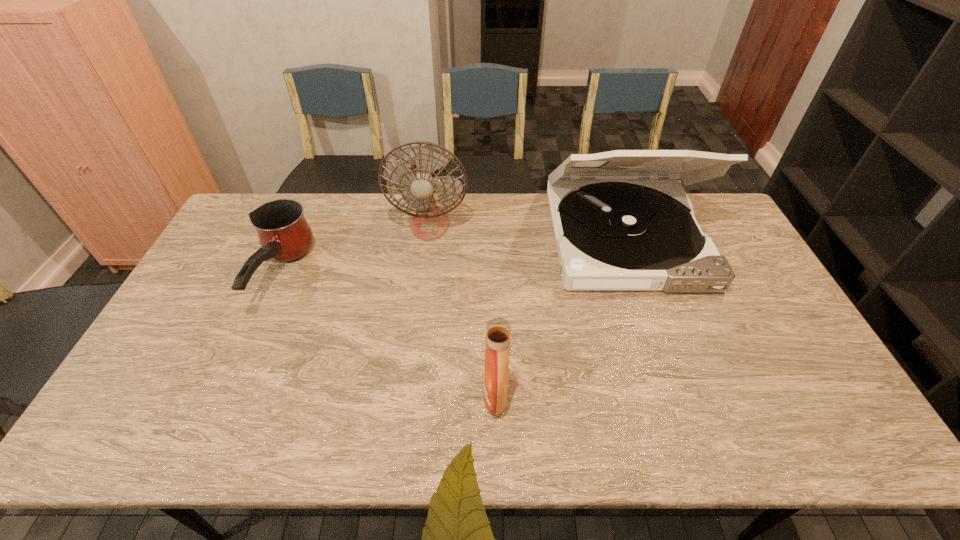
Identify the location of the rightmost object. (615, 229).

Image resolution: width=960 pixels, height=540 pixels. I want to click on the second object from left to right, so click(x=429, y=222).

Locate an element on the screen. This screenshot has width=960, height=540. the second shortest object is located at coordinates (498, 330).

The image size is (960, 540). In order to click on the nearest object in this screenshot , I will do `click(498, 330)`.

I want to click on saucepan, so click(284, 235).

Locate an element on the screen. This screenshot has width=960, height=540. the shortest object is located at coordinates (284, 235).

You are a GUI agent. You are given a task and a screenshot of the screen. Output one action in this format:
    pyautogui.click(x=<x>, y=<y>)
    Task: Click on the free space located 0.090m on the control panel of the rightmost object
    The height and width of the screenshot is (540, 960).
    Given the screenshot: What is the action you would take?
    pyautogui.click(x=654, y=320)

Find the location of a particular element. free space located 0.290m in front of the second object from left to right to direct airflow is located at coordinates (420, 309).

I want to click on free space located on the front-facing side of the second shortest object, so click(342, 396).

The width and height of the screenshot is (960, 540). I want to click on free point located on the front-facing side of the second shortest object, so click(350, 396).